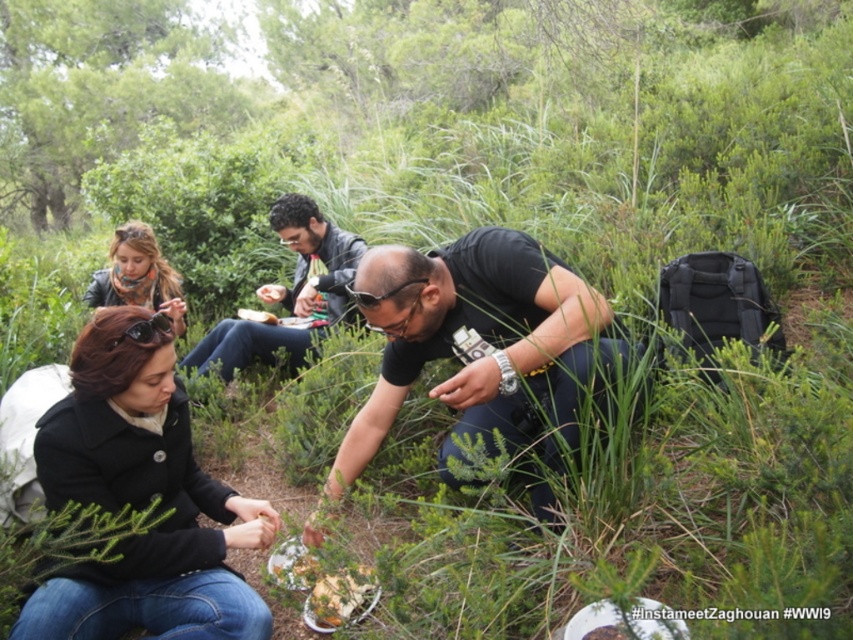
Does point (97, 320) come closer to viewer compared to point (407, 268)?

Yes.

Is black matte coat at lower left to the right of black matte shirt at center from the viewer's perspective?

Incorrect, black matte coat at lower left is not on the right side of black matte shirt at center.

Locate an element on the screen. This screenshot has height=640, width=853. black matte coat at lower left is located at coordinates (141, 499).

You are a GUI agent. You are given a task and a screenshot of the screen. Output one action in this format:
    pyautogui.click(x=<x>, y=<y>)
    Task: Click on the black matte coat at lower left
    The image size is (853, 640).
    Given the screenshot: What is the action you would take?
    pyautogui.click(x=141, y=499)

Is leather jacket at upper left bigger than white matte bread at center?

Correct, leather jacket at upper left is larger in size than white matte bread at center.

Measure the distance from leather jacket at upper left to white matte bread at center.

leather jacket at upper left and white matte bread at center are 55.52 centimeters apart.

The width and height of the screenshot is (853, 640). I want to click on leather jacket at upper left, so click(x=138, y=275).

Measure the distance between black matte shirt at center and camera.

The distance of black matte shirt at center from camera is 6.07 feet.

Is black matte shirt at center to the right of leather jacket at upper left from the viewer's perspective?

Yes, black matte shirt at center is to the right of leather jacket at upper left.

Where is `black matte shirt at center`? black matte shirt at center is located at coordinates (485, 342).